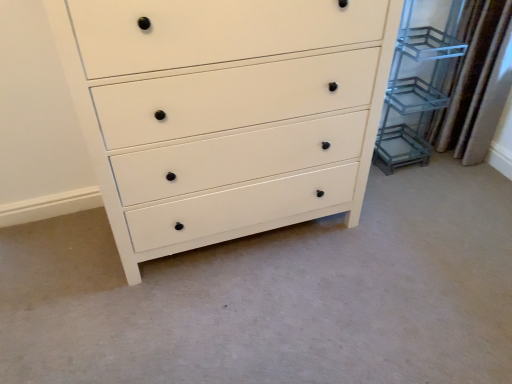
Where is `vacant area that is situated to the right of white matte chest of drawers at center`? The height and width of the screenshot is (384, 512). vacant area that is situated to the right of white matte chest of drawers at center is located at coordinates (416, 249).